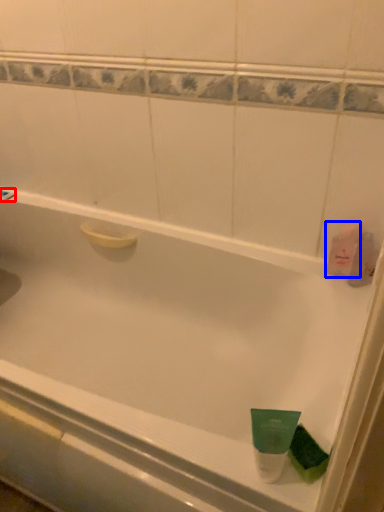
Question: Which of the following is the closest to the observer, shower (highlighted by a red box) or mouthwash (highlighted by a blue box)?

Choices:
 (A) shower
 (B) mouthwash

Answer: (B)